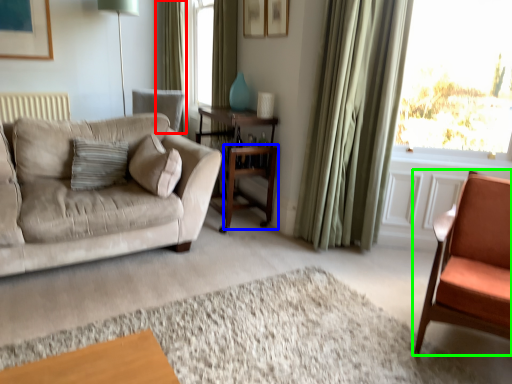
Question: Estimate the real-world distances between objects in this image. Which object is closer to curtain (highlighted by a red box), table (highlighted by a blue box) or chair (highlighted by a green box)?

Choices:
 (A) table
 (B) chair

Answer: (A)